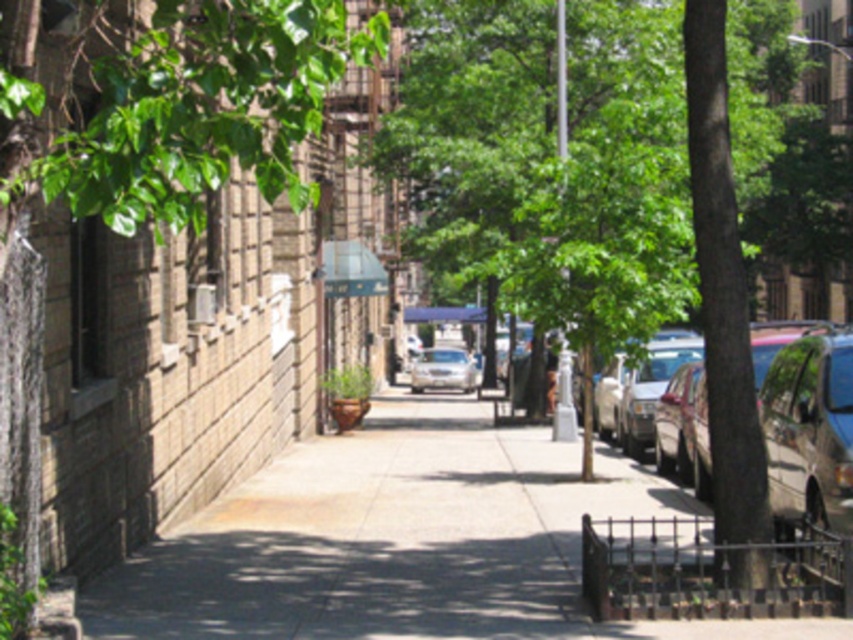
Can you confirm if smooth concrete sidewalk at center is wider than metallic silver car at right?

No.

Which is above, smooth concrete sidewalk at center or metallic silver car at right?

metallic silver car at right

Does point (412, 445) lie in front of point (821, 456)?

That is False.

You are a GUI agent. You are given a task and a screenshot of the screen. Output one action in this format:
    pyautogui.click(x=<x>, y=<y>)
    Task: Click on the smooth concrete sidewalk at center
    The image size is (853, 640).
    Given the screenshot: What is the action you would take?
    pyautogui.click(x=402, y=541)

Between green leafy tree at left and metallic silver car at right, which one has less height?

With less height is green leafy tree at left.

This screenshot has height=640, width=853. I want to click on green leafy tree at left, so click(141, 148).

Is point (256, 128) more distant than point (845, 499)?

No, (256, 128) is closer to viewer.

Where is `green leafy tree at left`? The height and width of the screenshot is (640, 853). green leafy tree at left is located at coordinates (141, 148).

Between green leafy tree at left and satin silver sedan at center, which one is positioned lower?

satin silver sedan at center is lower down.

Which is behind, point (22, 522) or point (432, 365)?

The point (432, 365) is behind.

Between point (225, 77) and point (428, 369), which one is positioned behind?

Point (428, 369)

You are a GUI agent. You are given a task and a screenshot of the screen. Output one action in this format:
    pyautogui.click(x=<x>, y=<y>)
    Task: Click on the green leafy tree at left
    The height and width of the screenshot is (640, 853).
    Given the screenshot: What is the action you would take?
    pyautogui.click(x=141, y=148)